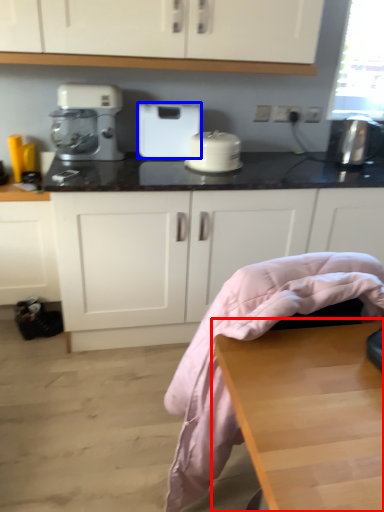
Question: Which object appears closest to the camera in this image, table (highlighted by a red box) or home appliance (highlighted by a blue box)?

Choices:
 (A) table
 (B) home appliance

Answer: (A)